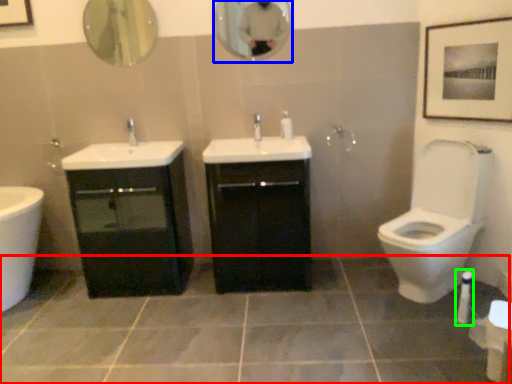
Question: Considering the real-world distances, which object is farthest from ceramic tile (highlighted by a red box)? mirror (highlighted by a blue box) or toiletry (highlighted by a green box)?

Choices:
 (A) mirror
 (B) toiletry

Answer: (A)